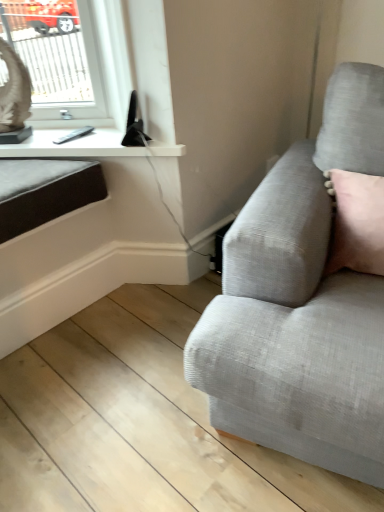
At what (x,y) coordinates should I click in order to perform the action: click on textured gray couch at right. Please return your answer as a coordinate pair (x, y). Looking at the image, I should click on (302, 303).

Image resolution: width=384 pixels, height=512 pixels. What do you see at coordinates (302, 303) in the screenshot?
I see `textured gray couch at right` at bounding box center [302, 303].

I want to click on textured gray couch at right, so click(302, 303).